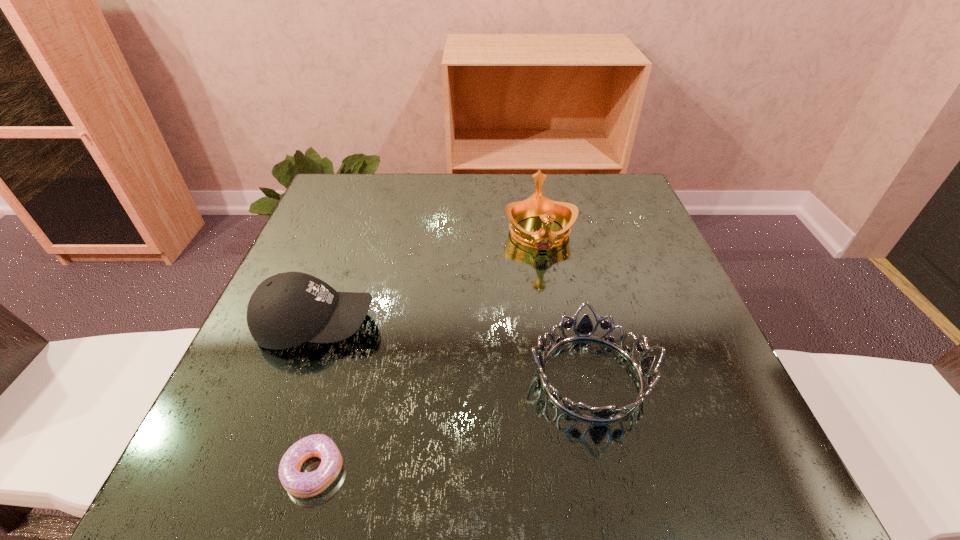
This screenshot has width=960, height=540. I want to click on vacant space that satisfies the following two spatial constraints: 1. on the front-facing side of the second shortest object; 2. on the front side of the shortest object, so click(x=612, y=470).

I want to click on blank space that satisfies the following two spatial constraints: 1. on the back side of the shortest object; 2. on the front-facing side of the baseball cap, so click(x=355, y=325).